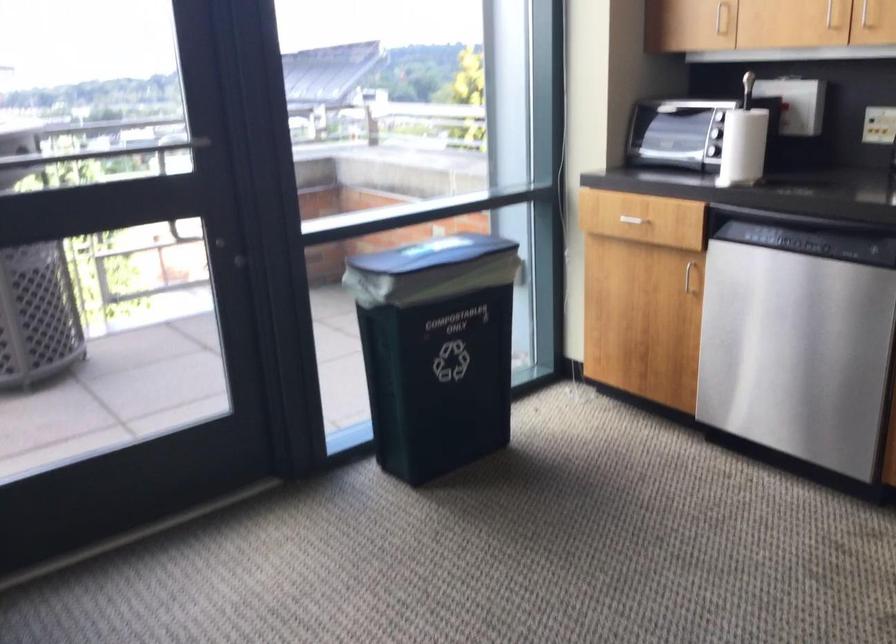
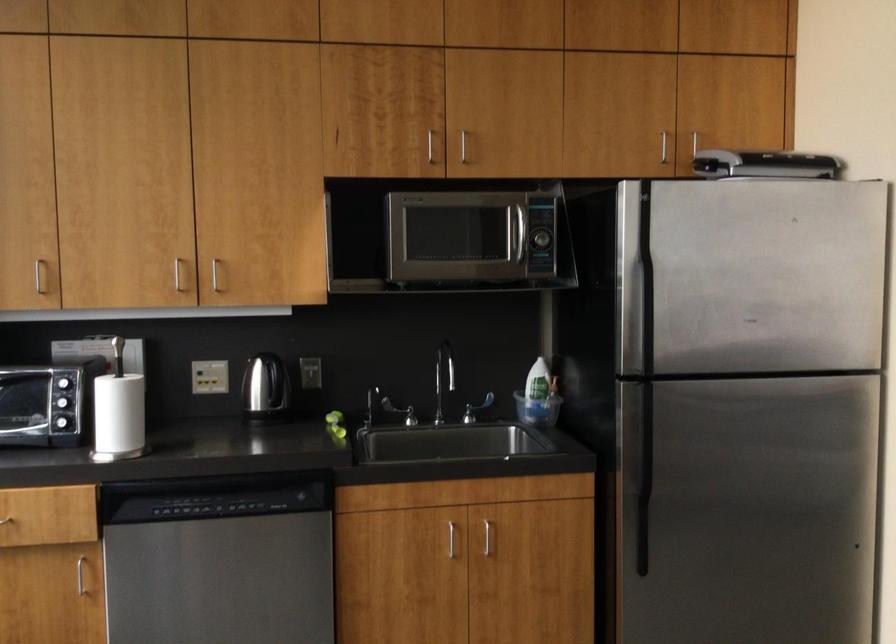
Locate, in the second image, the point that corresponds to point (728, 146) in the first image.

(117, 415)